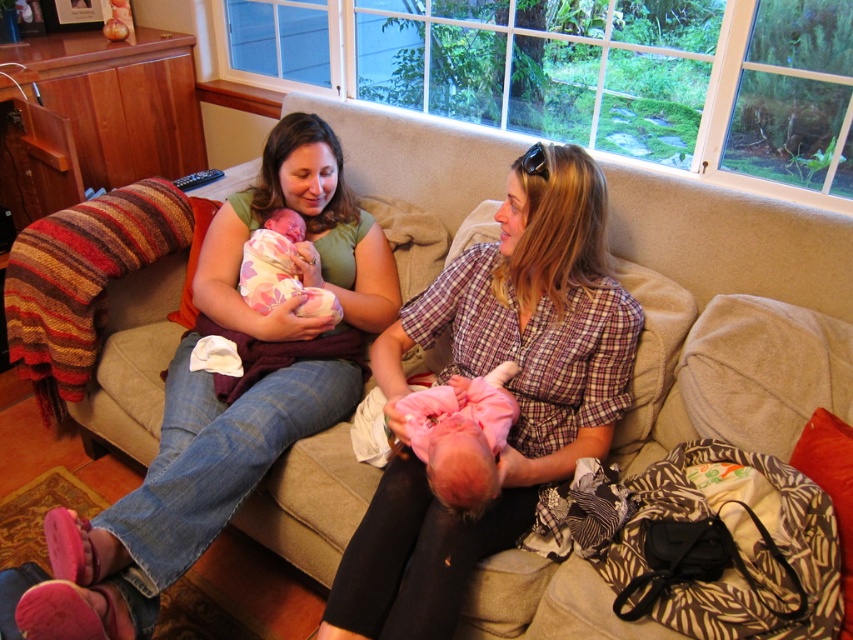
Question: Which is farther from the pink soft fabric baby at center?

Choices:
 (A) fluffy pink blanket at center
 (B) matte plaid shirt at center
 (C) matte green shirt at upper left

Answer: (A)

Question: Which of the following is the farthest from the observer?

Choices:
 (A) matte green shirt at upper left
 (B) matte plaid shirt at center

Answer: (B)

Question: Which of the following is the farthest from the observer?

Choices:
 (A) (286, 244)
 (B) (288, 312)
 (C) (451, 557)

Answer: (A)

Question: Can you confirm if matte green shirt at upper left is positioned to the left of fluffy pink blanket at center?

Choices:
 (A) no
 (B) yes

Answer: (B)

Question: Is matte green shirt at upper left behind matte plaid shirt at center?

Choices:
 (A) no
 (B) yes

Answer: (A)

Question: Is matte green shirt at upper left thinner than fluffy pink blanket at center?

Choices:
 (A) no
 (B) yes

Answer: (A)